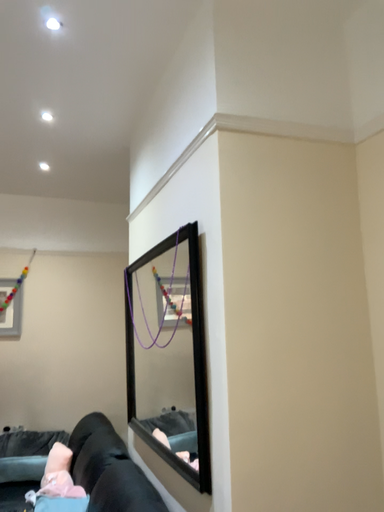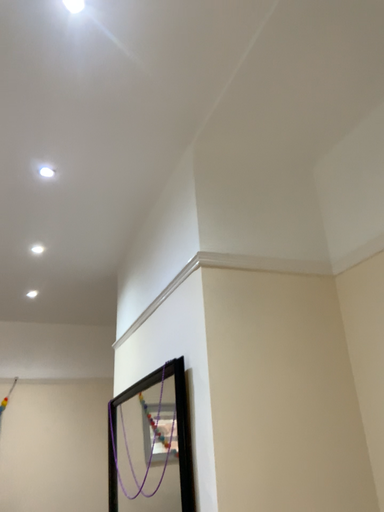
Question: How did the camera likely rotate when shooting the video?

Choices:
 (A) rotated downward
 (B) rotated upward

Answer: (B)